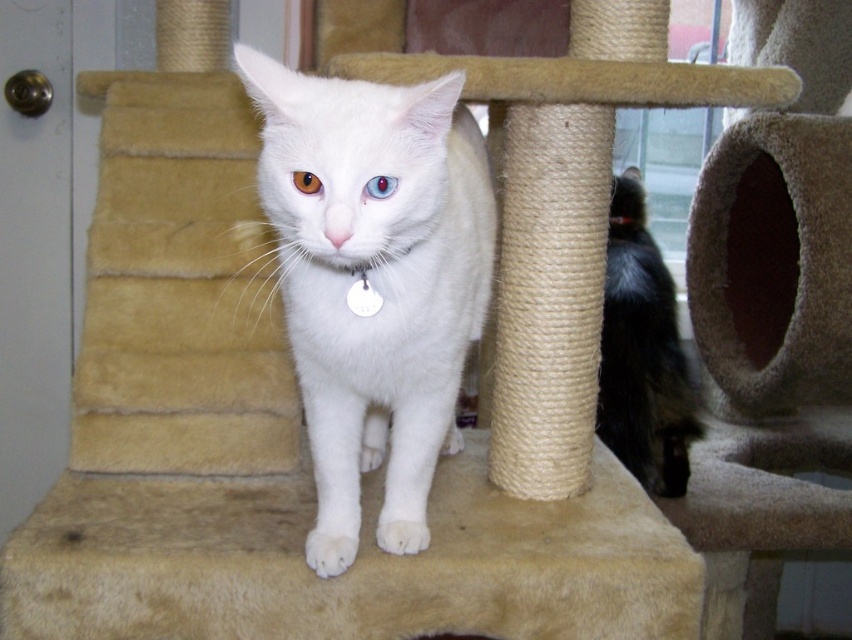
You are a cat owner who wants to place a new toy on the cat tree where the white fur cat at center is standing. The toy requires a space taller than the cat to be placed safely. Can the beige carpeted cat bed at center provide enough height for this?

The beige carpeted cat bed at center is taller than the white fur cat at center, so it can provide enough height for the toy to be placed safely.

You are a veterinarian examining the white fur cat at center. You notice the brown glossy eye at center. Which object is bigger in size?

The white fur cat at center is larger in size compared to the brown glossy eye at center.